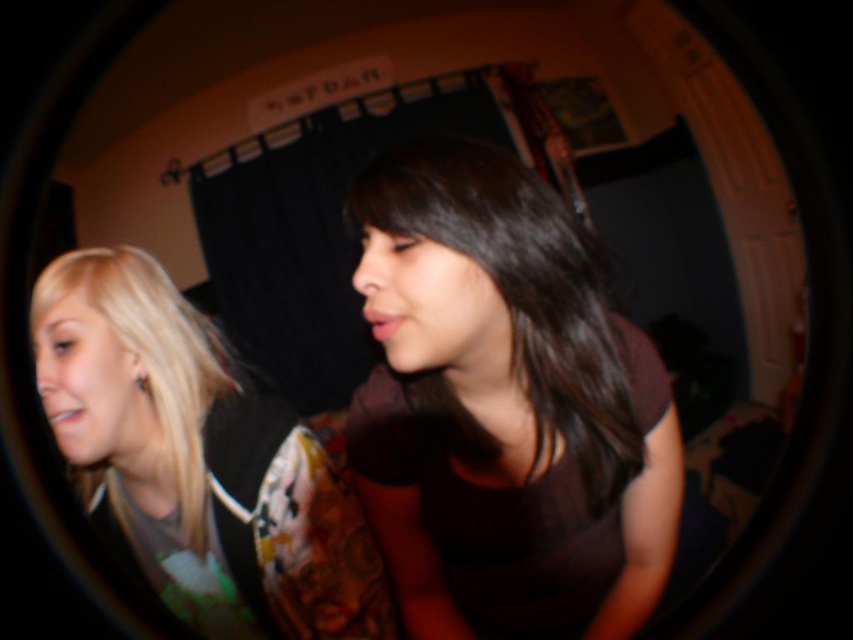
At what (x,y) coordinates should I click in order to perform the action: click on dark brown fabric at center. Please return your answer as a coordinate pair (x, y). This screenshot has width=853, height=640. Looking at the image, I should click on (503, 406).

Between dark brown fabric at center and blonde hair at left, which one appears on the right side from the viewer's perspective?

dark brown fabric at center is more to the right.

Who is more distant from viewer, (671,531) or (167,356)?

The point (671,531) is more distant.

Locate an element on the screen. dark brown fabric at center is located at coordinates (503, 406).